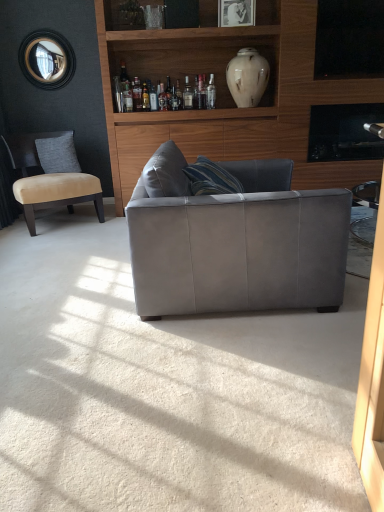
Question: Does gray fabric pillow at left have a larger size compared to beige fabric chair at left?

Choices:
 (A) no
 (B) yes

Answer: (A)

Question: Considering the relative positions of gray fabric pillow at left and beige fabric chair at left in the image provided, is gray fabric pillow at left to the right of beige fabric chair at left from the viewer's perspective?

Choices:
 (A) yes
 (B) no

Answer: (A)

Question: From the image's perspective, does gray fabric pillow at left appear lower than beige fabric chair at left?

Choices:
 (A) yes
 (B) no

Answer: (B)

Question: Can you confirm if gray fabric pillow at left is wider than beige fabric chair at left?

Choices:
 (A) no
 (B) yes

Answer: (A)

Question: Is gray fabric pillow at left far from beige fabric chair at left?

Choices:
 (A) no
 (B) yes

Answer: (A)

Question: Considering the positions of black glass window screen at upper right and beige fabric chair at left in the image, is black glass window screen at upper right wider or thinner than beige fabric chair at left?

Choices:
 (A) wide
 (B) thin

Answer: (B)

Question: Considering the positions of point (360, 50) and point (56, 148), is point (360, 50) closer or farther from the camera than point (56, 148)?

Choices:
 (A) closer
 (B) farther

Answer: (A)

Question: In terms of height, does black glass window screen at upper right look taller or shorter compared to beige fabric chair at left?

Choices:
 (A) short
 (B) tall

Answer: (A)

Question: Which is correct: black glass window screen at upper right is inside beige fabric chair at left, or outside of it?

Choices:
 (A) inside
 (B) outside

Answer: (B)

Question: From a real-world perspective, relative to translucent glass bottle at upper center, which is counted as the second bottle, starting from the right, is suede gray couch at center vertically above or below?

Choices:
 (A) above
 (B) below

Answer: (B)

Question: Considering the positions of suede gray couch at center and translucent glass bottle at upper center, the 2th bottle when ordered from left to right, in the image, is suede gray couch at center bigger or smaller than translucent glass bottle at upper center, the 2th bottle when ordered from left to right,?

Choices:
 (A) big
 (B) small

Answer: (A)

Question: In the image, is suede gray couch at center positioned in front of or behind translucent glass bottle at upper center, the 2th bottle when ordered from left to right?

Choices:
 (A) behind
 (B) front

Answer: (B)

Question: In terms of width, does suede gray couch at center look wider or thinner when compared to translucent glass bottle at upper center, the 2th bottle when ordered from left to right?

Choices:
 (A) wide
 (B) thin

Answer: (A)

Question: Is translucent glass bottle at upper center, the 2th bottle when ordered from left to right, taller or shorter than beige fabric chair at left?

Choices:
 (A) tall
 (B) short

Answer: (B)

Question: Relative to beige fabric chair at left, is translucent glass bottle at upper center, the 2th bottle when ordered from left to right, in front or behind?

Choices:
 (A) behind
 (B) front

Answer: (A)